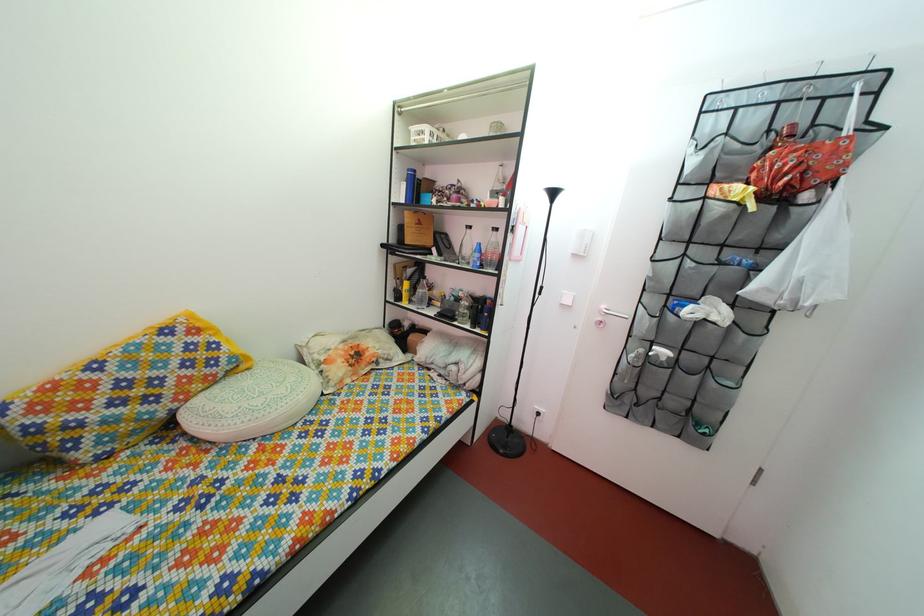
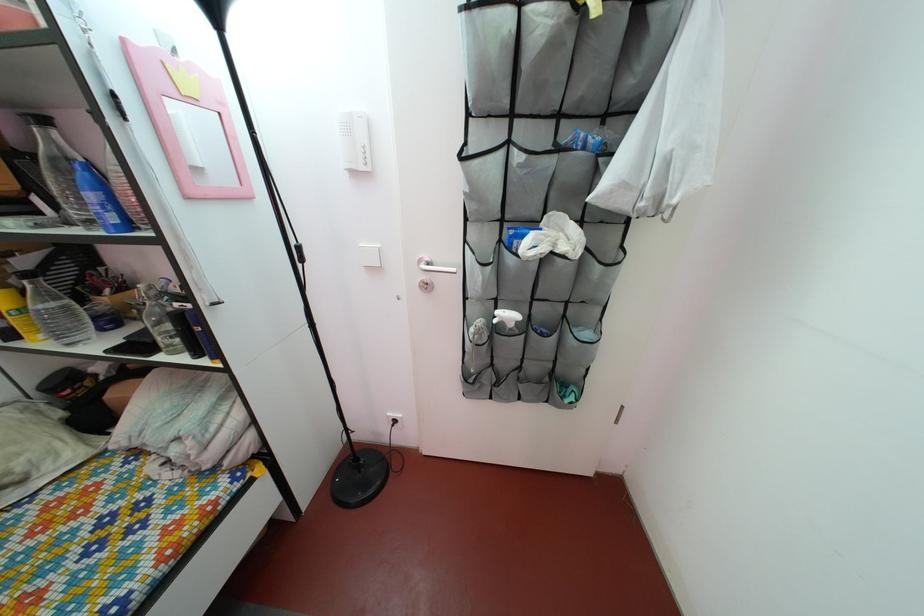
Where in the second image is the point corresponding to point (488, 273) from the first image?

(124, 229)